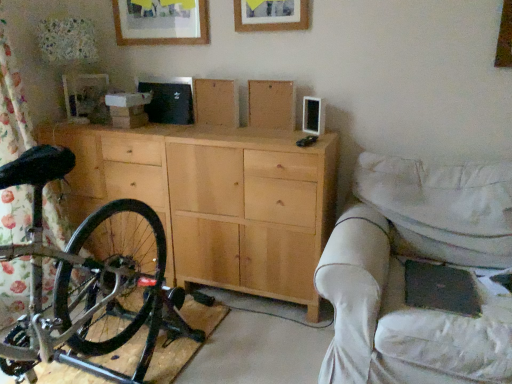
What do you see at coordinates (84, 283) in the screenshot? The width and height of the screenshot is (512, 384). I see `shiny black bicycle at left` at bounding box center [84, 283].

Describe the element at coordinates (403, 273) in the screenshot. I see `white fabric couch at right` at that location.

Measure the distance between natural wood cabinet at center and camera.

A distance of 1.88 meters exists between natural wood cabinet at center and camera.

Looking at this image, in order to face natural wood cabinet at center, should I rotate leftwards or rightwards?

Rotate left and turn 9.229 degrees.

This screenshot has height=384, width=512. Find the location of `shiny black bicycle at left`. shiny black bicycle at left is located at coordinates (84, 283).

Is shiny black bicycle at left outside of wooden picture frame at upper center, which is the second picture frame from back to front?

That's correct, shiny black bicycle at left is outside of wooden picture frame at upper center, which is the second picture frame from back to front.

From a real-world perspective, is shiny black bicycle at left physically located above or below wooden picture frame at upper center, which is counted as the 1th picture frame, starting from the right?

From a real-world perspective, shiny black bicycle at left is physically below wooden picture frame at upper center, which is counted as the 1th picture frame, starting from the right.

Which of these two, shiny black bicycle at left or wooden picture frame at upper center, which is the second picture frame from back to front, is thinner?

Thinner between the two is wooden picture frame at upper center, which is the second picture frame from back to front.

Would you consider shiny black bicycle at left to be distant from wooden picture frame at upper center, marked as the second picture frame in a left-to-right arrangement?

shiny black bicycle at left is far away from wooden picture frame at upper center, marked as the second picture frame in a left-to-right arrangement.

From the image's perspective, is white fabric couch at right located beneath wooden picture frame at upper center, which is the 1th picture frame in left-to-right order?

Yes.

Looking at this image, how many degrees apart are the facing directions of white fabric couch at right and wooden picture frame at upper center, which is counted as the second picture frame, starting from the front?

0.582 degrees separate the facing orientations of white fabric couch at right and wooden picture frame at upper center, which is counted as the second picture frame, starting from the front.

Is point (479, 188) closer to camera compared to point (170, 8)?

That is True.

Is white fabric couch at right bigger than wooden picture frame at upper center, which is counted as the second picture frame, starting from the front?

Yes.

Are natural wood cabinet at center and white fabric couch at right located far from each other?

They are positioned close to each other.

How different are the orientations of natural wood cabinet at center and white fabric couch at right in degrees?

0.405 degrees.

Is natural wood cabinet at center to the left of white fabric couch at right from the viewer's perspective?

Yes.

Considering the points (186, 286) and (428, 245), which point is in front, point (186, 286) or point (428, 245)?

The point (428, 245) is more forward.

Could you tell me if wooden picture frame at upper center, marked as the second picture frame in a left-to-right arrangement, is facing wooden picture frame at upper center, which is the 1th picture frame in left-to-right order?

No, wooden picture frame at upper center, marked as the second picture frame in a left-to-right arrangement, is not turned towards wooden picture frame at upper center, which is the 1th picture frame in left-to-right order.

In the scene shown: From a real-world perspective, who is located higher, wooden picture frame at upper center, which is the second picture frame from back to front, or wooden picture frame at upper center, which is counted as the second picture frame, starting from the front?

In real-world perspective, wooden picture frame at upper center, which is the second picture frame from back to front, is above.

Where is `picture frame to the left of wooden picture frame at upper center, which is the second picture frame from back to front`? The image size is (512, 384). picture frame to the left of wooden picture frame at upper center, which is the second picture frame from back to front is located at coordinates (161, 22).

Considering the relative sizes of wooden picture frame at upper center, the 1th picture frame viewed from the front, and wooden picture frame at upper center, acting as the first picture frame starting from the back, in the image provided, is wooden picture frame at upper center, the 1th picture frame viewed from the front, shorter than wooden picture frame at upper center, acting as the first picture frame starting from the back,?

No, wooden picture frame at upper center, the 1th picture frame viewed from the front, is not shorter than wooden picture frame at upper center, acting as the first picture frame starting from the back.

From the image's perspective, would you say wooden picture frame at upper center, which is the 1th picture frame in left-to-right order, is shown under white fabric couch at right?

Actually, wooden picture frame at upper center, which is the 1th picture frame in left-to-right order, appears above white fabric couch at right in the image.

Who is shorter, wooden picture frame at upper center, which is counted as the second picture frame, starting from the front, or white fabric couch at right?

Standing shorter between the two is wooden picture frame at upper center, which is counted as the second picture frame, starting from the front.

Which of these two, wooden picture frame at upper center, acting as the first picture frame starting from the back, or white fabric couch at right, is smaller?

With smaller size is wooden picture frame at upper center, acting as the first picture frame starting from the back.

This screenshot has height=384, width=512. I want to click on the chest of drawers lying behind the shiny black bicycle at left, so click(x=216, y=200).

Can you see natural wood cabinet at center touching shiny black bicycle at left?

natural wood cabinet at center and shiny black bicycle at left are not in contact.

Does natural wood cabinet at center have a larger size compared to shiny black bicycle at left?

Incorrect, natural wood cabinet at center is not larger than shiny black bicycle at left.

Is natural wood cabinet at center spatially inside shiny black bicycle at left, or outside of it?

natural wood cabinet at center exists outside the volume of shiny black bicycle at left.

Is wooden picture frame at upper center, the 1th picture frame viewed from the front, smaller than natural wood cabinet at center?

Yes.

Consider the image. How far apart are wooden picture frame at upper center, which is the second picture frame from back to front, and natural wood cabinet at center?

wooden picture frame at upper center, which is the second picture frame from back to front, is 88.06 centimeters from natural wood cabinet at center.

Which object is positioned more to the left, wooden picture frame at upper center, which is counted as the 1th picture frame, starting from the right, or natural wood cabinet at center?

natural wood cabinet at center is more to the left.

From the image's perspective, which one is positioned lower, wooden picture frame at upper center, the 1th picture frame viewed from the front, or natural wood cabinet at center?

natural wood cabinet at center, from the image's perspective.

At what (x,y) coordinates should I click in order to perform the action: click on bicycle in front of the wooden picture frame at upper center, marked as the second picture frame in a left-to-right arrangement. Please return your answer as a coordinate pair (x, y). This screenshot has height=384, width=512. Looking at the image, I should click on (84, 283).

At what (x,y) coordinates should I click in order to perform the action: click on studio couch on the right of wooden picture frame at upper center, the 2th picture frame in the right-to-left sequence. Please return your answer as a coordinate pair (x, y). The width and height of the screenshot is (512, 384). Looking at the image, I should click on (403, 273).

Estimate the real-world distances between objects in this image. Which object is closer to white fabric couch at right, wooden picture frame at upper center, the 2th picture frame in the right-to-left sequence, or shiny black bicycle at left?

shiny black bicycle at left lies closer to white fabric couch at right than the other object.

Considering their positions, is white fabric couch at right positioned closer to wooden picture frame at upper center, which is counted as the 1th picture frame, starting from the right, than wooden picture frame at upper center, which is counted as the second picture frame, starting from the front?

wooden picture frame at upper center, which is counted as the second picture frame, starting from the front, lies closer to wooden picture frame at upper center, which is counted as the 1th picture frame, starting from the right, than the other object.

When comparing their distances from wooden picture frame at upper center, acting as the first picture frame starting from the back, does shiny black bicycle at left or wooden picture frame at upper center, the 1th picture frame viewed from the front, seem further?

shiny black bicycle at left lies further to wooden picture frame at upper center, acting as the first picture frame starting from the back, than the other object.

Considering their positions, is shiny black bicycle at left positioned closer to wooden picture frame at upper center, the 1th picture frame viewed from the front, than white fabric couch at right?

white fabric couch at right.

Estimate the real-world distances between objects in this image. Which object is further from natural wood cabinet at center, wooden picture frame at upper center, which is counted as the second picture frame, starting from the front, or wooden picture frame at upper center, the 1th picture frame viewed from the front?

wooden picture frame at upper center, the 1th picture frame viewed from the front, is positioned further to the anchor natural wood cabinet at center.

Estimate the real-world distances between objects in this image. Which object is further from shiny black bicycle at left, wooden picture frame at upper center, which is the second picture frame from back to front, or white fabric couch at right?

Based on the image, wooden picture frame at upper center, which is the second picture frame from back to front, appears to be further to shiny black bicycle at left.

Looking at the image, which one is located further to white fabric couch at right, wooden picture frame at upper center, which is the second picture frame from back to front, or wooden picture frame at upper center, which is counted as the second picture frame, starting from the front?

wooden picture frame at upper center, which is counted as the second picture frame, starting from the front, lies further to white fabric couch at right than the other object.

Consider the image. Estimate the real-world distances between objects in this image. Which object is closer to wooden picture frame at upper center, which is the 1th picture frame in left-to-right order, shiny black bicycle at left or natural wood cabinet at center?

natural wood cabinet at center lies closer to wooden picture frame at upper center, which is the 1th picture frame in left-to-right order, than the other object.

Where is `chest of drawers between shiny black bicycle at left and wooden picture frame at upper center, acting as the first picture frame starting from the back, along the z-axis`? Image resolution: width=512 pixels, height=384 pixels. chest of drawers between shiny black bicycle at left and wooden picture frame at upper center, acting as the first picture frame starting from the back, along the z-axis is located at coordinates (216, 200).

At what (x,y) coordinates should I click in order to perform the action: click on chest of drawers between wooden picture frame at upper center, which is counted as the 1th picture frame, starting from the right, and white fabric couch at right, in the vertical direction. Please return your answer as a coordinate pair (x, y). The width and height of the screenshot is (512, 384). Looking at the image, I should click on (216, 200).

The width and height of the screenshot is (512, 384). I want to click on picture frame that lies between wooden picture frame at upper center, the 1th picture frame viewed from the front, and natural wood cabinet at center from top to bottom, so click(x=161, y=22).

Identify the location of chest of drawers between wooden picture frame at upper center, the 2th picture frame in the right-to-left sequence, and white fabric couch at right, in the horizontal direction. (216, 200).